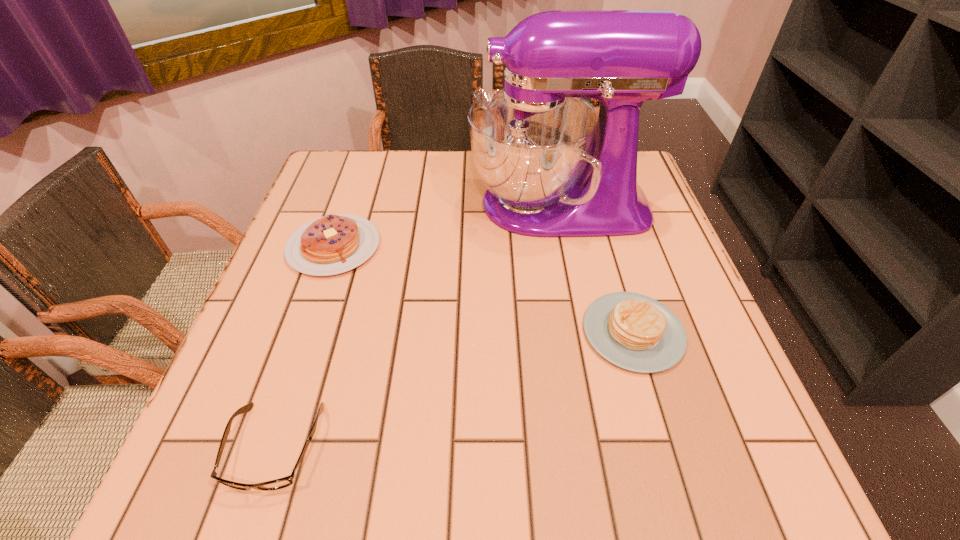
Find the location of a particular element. The image size is (960, 540). vacant area at the left edge of the desktop is located at coordinates click(x=319, y=346).

This screenshot has height=540, width=960. I want to click on free space at the right edge of the desktop, so click(x=711, y=352).

At what (x,y) coordinates should I click in order to perform the action: click on vacant position at the far left corner of the desktop. Please return your answer as a coordinate pair (x, y). Looking at the image, I should click on (382, 156).

Identify the location of free space that is in between the farther pancake and the tallest object. (446, 226).

I want to click on vacant point located between the left pancake and the spectacles, so click(x=304, y=347).

You are a GUI agent. You are given a task and a screenshot of the screen. Output one action in this format:
    pyautogui.click(x=<x>, y=<y>)
    Task: Click on the free space between the mixer and the nearer pancake
    The height and width of the screenshot is (540, 960).
    Given the screenshot: What is the action you would take?
    pyautogui.click(x=596, y=268)

I want to click on free space between the mixer and the third farthest object, so click(x=596, y=268).

The width and height of the screenshot is (960, 540). What are the coordinates of `free area in between the tallest object and the spectacles` in the screenshot? It's located at (417, 326).

The height and width of the screenshot is (540, 960). What are the coordinates of `blank region between the right pancake and the mixer` in the screenshot? It's located at (596, 268).

The width and height of the screenshot is (960, 540). Find the location of `free spot between the left pancake and the right pancake`. free spot between the left pancake and the right pancake is located at coordinates (484, 289).